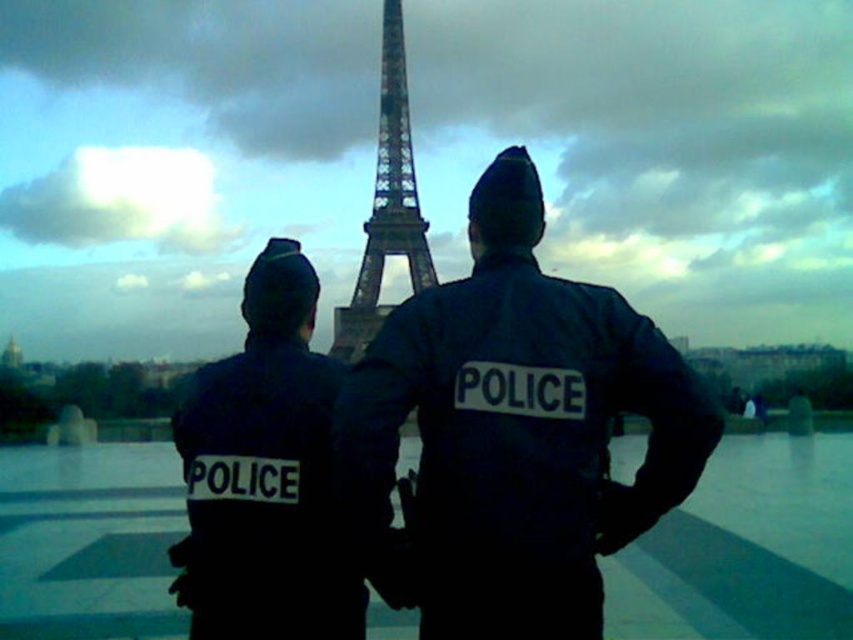
You are a tourist in Paris and you see the dark blue uniform at center and the metallic lattice structure at center in the image. Which object is positioned to the right of the other?

The dark blue uniform at center is to the right of the metallic lattice structure at center.